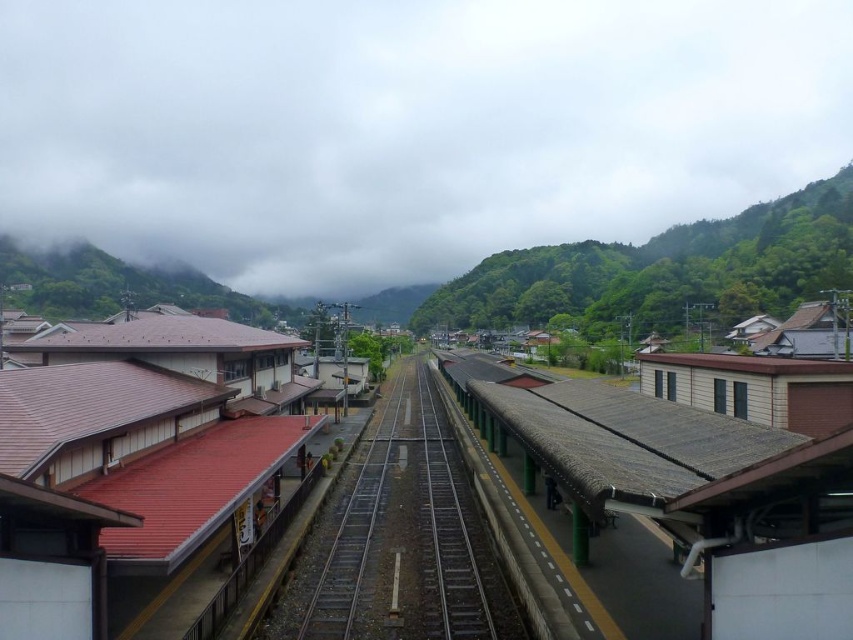
You are a traveler standing at the entrance of the station and want to cross the tracks safely. The brown thatched roof platform at center and the green corrugated metal train track at center are in your path. Which object should you step on to avoid the train tracks?

You should step onto the brown thatched roof platform at center because its width surpasses that of the green corrugated metal train track at center, providing a safer and wider path to avoid the train tracks.

You are a passenger standing at the station entrance. You see the brown thatched roof platform at center and the green corrugated metal train track at center. Which object is positioned to the right of the other?

The brown thatched roof platform at center is to the right of the green corrugated metal train track at center.